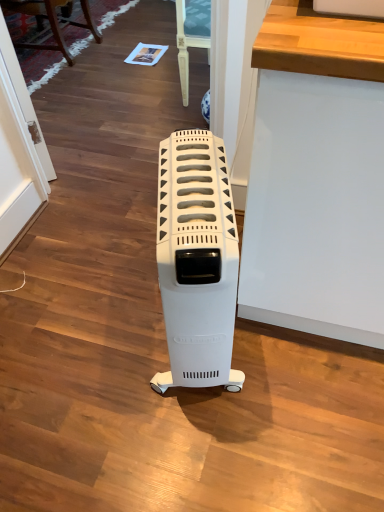
In order to click on vacant area that lies in front of white plastic heater at center in this screenshot , I will do `click(200, 445)`.